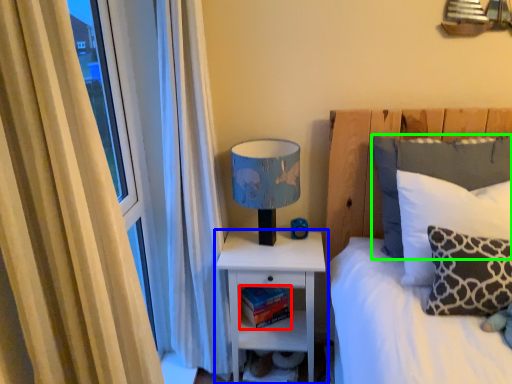
Question: Based on their relative distances, which object is nearer to book (highlighted by a red box)? Choose from nightstand (highlighted by a blue box) and pillow (highlighted by a green box).

Choices:
 (A) nightstand
 (B) pillow

Answer: (A)